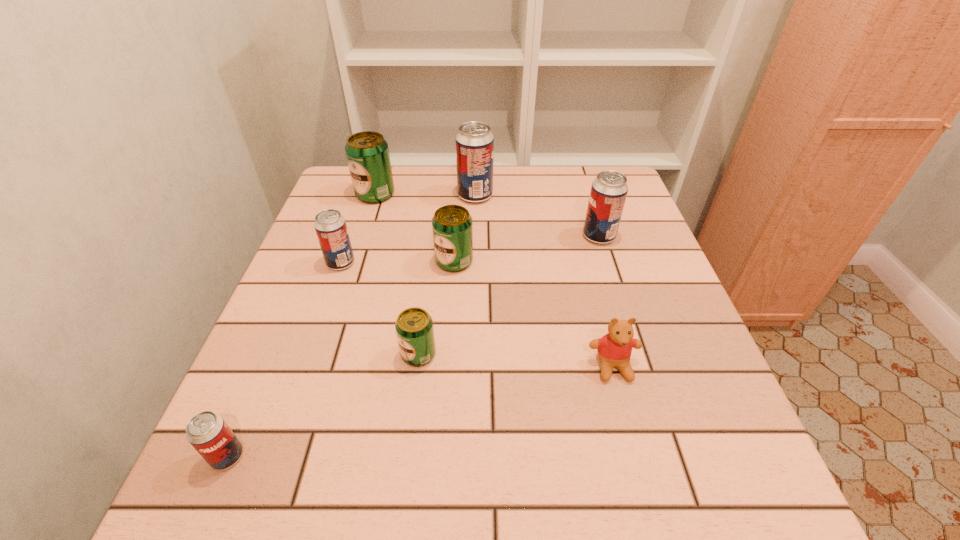
Find the location of a particular element. Image resolution: width=960 pixels, height=540 pixels. object that is the third nearest to the leftmost green beer can is located at coordinates (452, 227).

The height and width of the screenshot is (540, 960). In order to click on the second closest object to the second smallest green beer can in this screenshot , I will do `click(474, 142)`.

Choose which beer can is the nearest neighbor to the rightmost red beer can. Please provide its 2D coordinates. Your answer should be formatted as a tuple, i.e. [(x, y)], where the tuple contains the x and y coordinates of a point satisfying the conditions above.

[(474, 142)]

I want to click on the fourth closest beer can to the nearest green beer can, so click(609, 190).

Select which red beer can appears as the second closest to the third farthest object. Please provide its 2D coordinates. Your answer should be formatted as a tuple, i.e. [(x, y)], where the tuple contains the x and y coordinates of a point satisfying the conditions above.

[(330, 226)]

Identify which red beer can is the second closest to the farthest green beer can. Please provide its 2D coordinates. Your answer should be formatted as a tuple, i.e. [(x, y)], where the tuple contains the x and y coordinates of a point satisfying the conditions above.

[(330, 226)]

The height and width of the screenshot is (540, 960). What are the coordinates of `green beer can object that ranks as the second closest to the red teddy bear` in the screenshot? It's located at (452, 227).

Select which green beer can appears as the second closest to the second biggest green beer can. Please provide its 2D coordinates. Your answer should be formatted as a tuple, i.e. [(x, y)], where the tuple contains the x and y coordinates of a point satisfying the conditions above.

[(367, 152)]

Where is `vacant point that satisfies the following two spatial constraints: 1. on the back side of the third nearest red beer can; 2. on the left side of the second nearest green beer can`? vacant point that satisfies the following two spatial constraints: 1. on the back side of the third nearest red beer can; 2. on the left side of the second nearest green beer can is located at coordinates (456, 236).

Where is `free location that satisfies the following two spatial constraints: 1. on the back side of the second nearest green beer can; 2. on the right side of the tallest object`? free location that satisfies the following two spatial constraints: 1. on the back side of the second nearest green beer can; 2. on the right side of the tallest object is located at coordinates (459, 195).